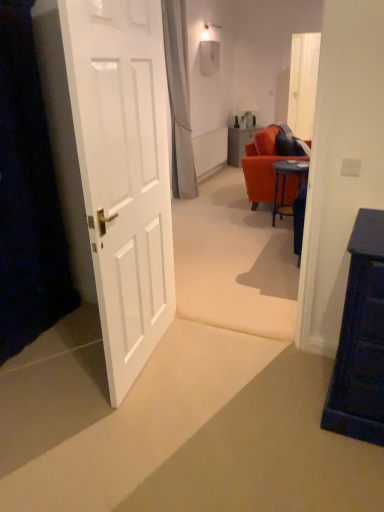
Question: Is point (150, 19) positioned closer to the camera than point (235, 132)?

Choices:
 (A) closer
 (B) farther

Answer: (A)

Question: Is white glossy door at left inside the boundaries of matte orange table at center, or outside?

Choices:
 (A) outside
 (B) inside

Answer: (A)

Question: Based on their relative distances, which object is nearer to the matte orange table at center?

Choices:
 (A) matte white lampshade at center
 (B) transparent glass door at upper center
 (C) white glossy door at left
 (D) blue glossy desk at center
 (E) white fabric curtain at upper center

Answer: (A)

Question: Considering the real-world distances, which object is farthest from the matte orange table at center?

Choices:
 (A) transparent glass door at upper center
 (B) white fabric curtain at upper center
 (C) matte white lampshade at center
 (D) white glossy door at left
 (E) blue glossy desk at center

Answer: (D)